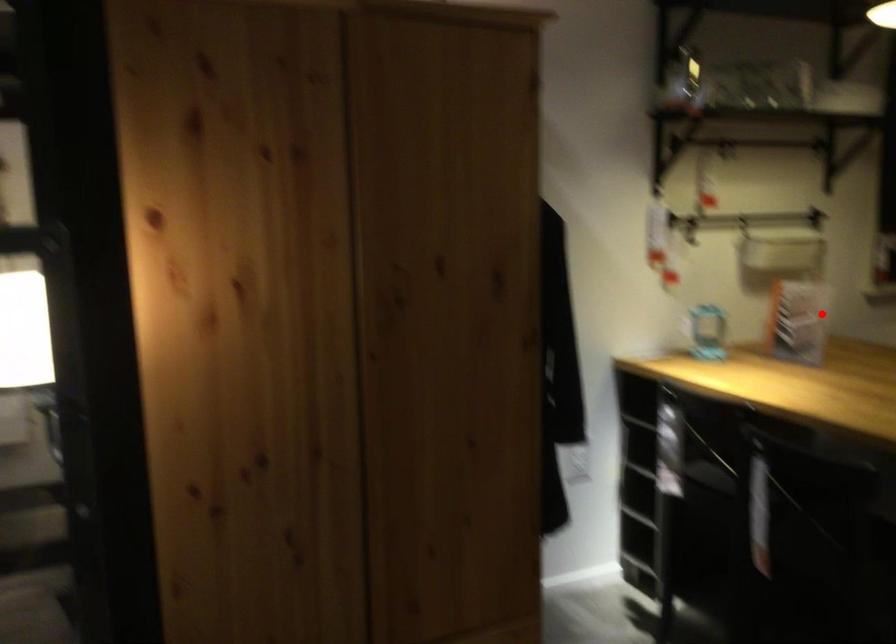
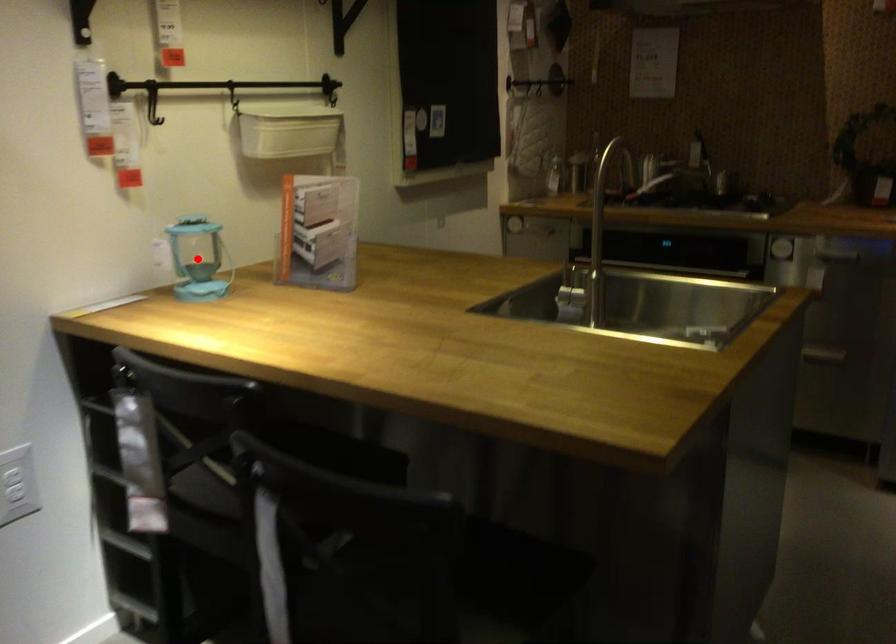
I am providing you with two images of the same scene from different viewpoints. A red point is marked on the first image and another point is marked on the second image. Do the highlighted points in image1 and image2 indicate the same real-world spot?

No